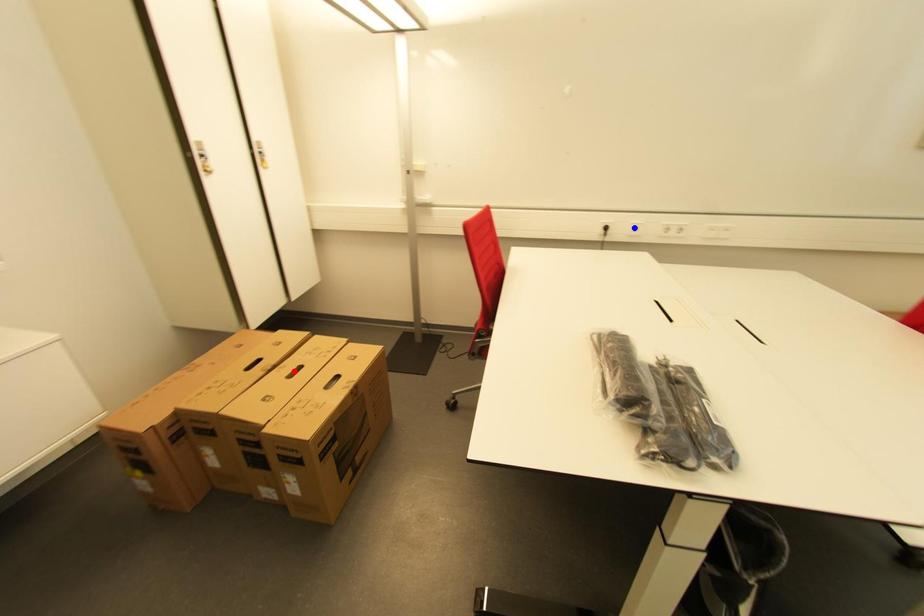
Question: In the image, two points are highlighted. Which point is nearer to the camera? Reply with the corresponding letter.

Choices:
 (A) blue point
 (B) red point

Answer: (B)